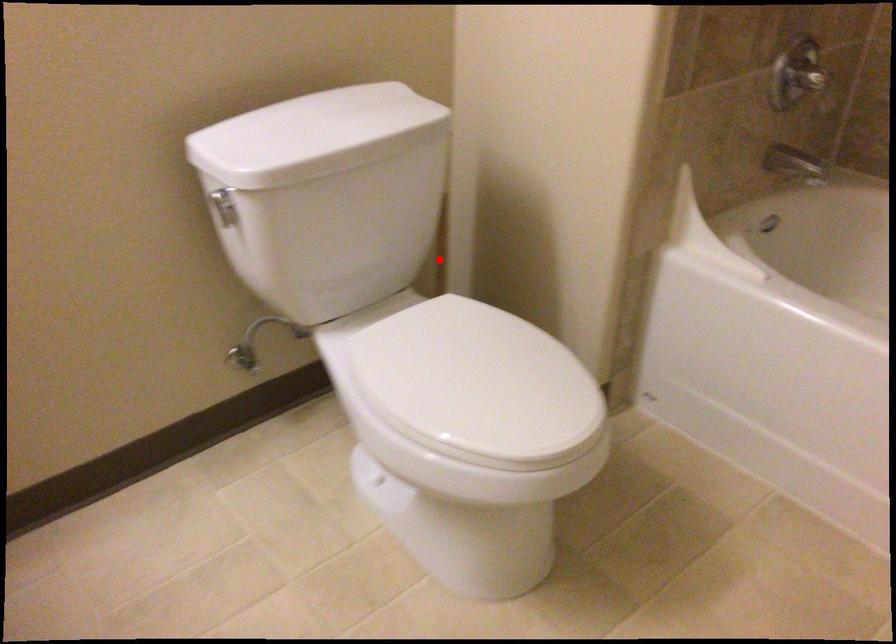
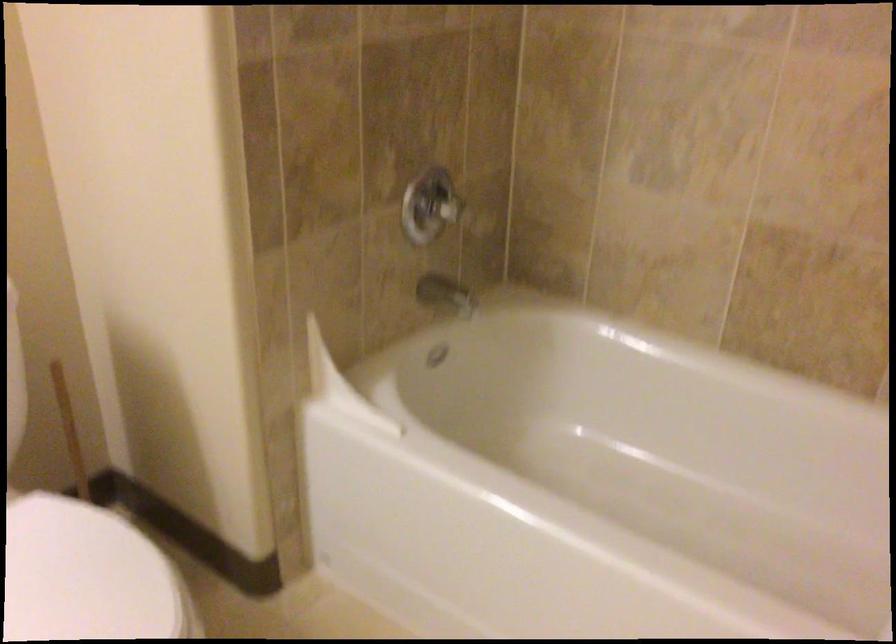
Question: I am providing you with two images of the same scene from different viewpoints. In image1, a red point is highlighted. Considering the same 3D point in image2, which of the following is correct?

Choices:
 (A) It is closer
 (B) It is farther

Answer: (A)